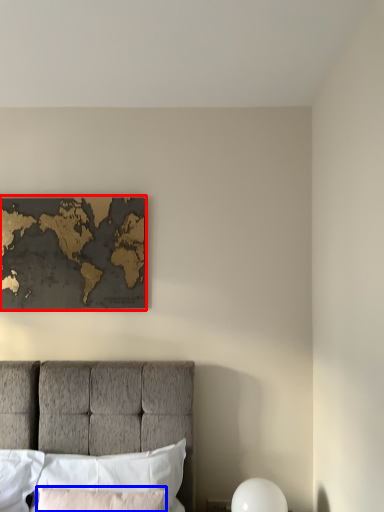
Question: Which of the following is the farthest to the observer, picture frame (highlighted by a red box) or pillow (highlighted by a blue box)?

Choices:
 (A) picture frame
 (B) pillow

Answer: (A)